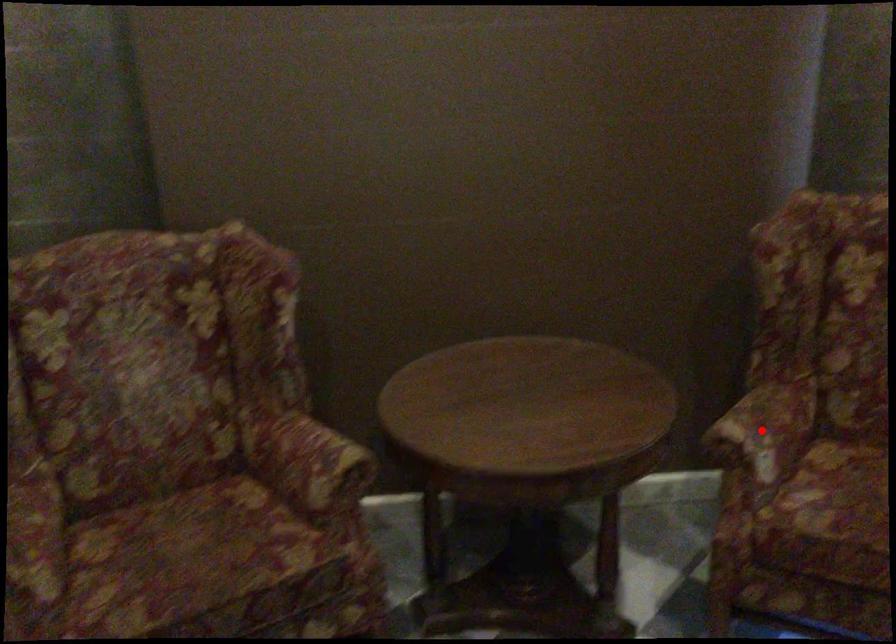
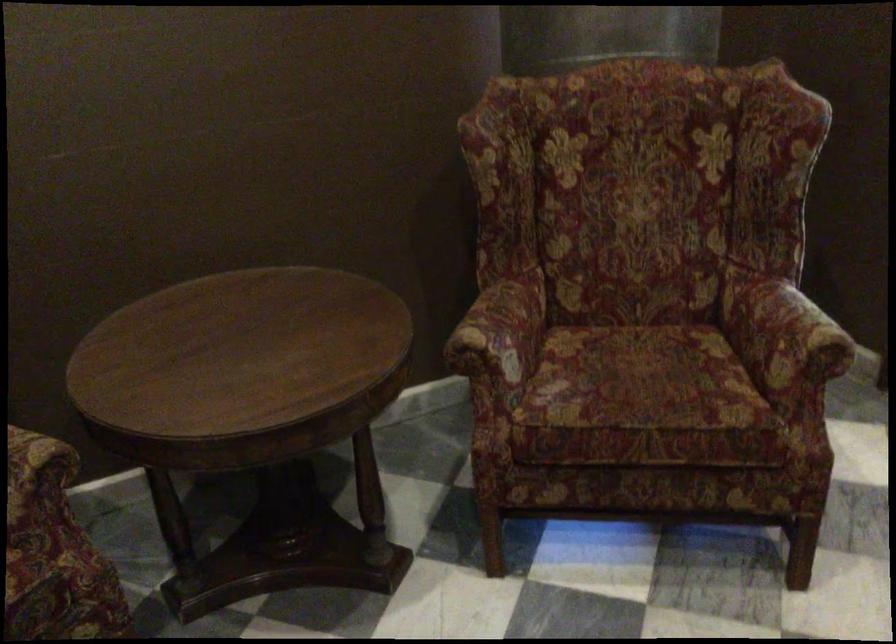
Locate, in the second image, the point that corresponds to the highlighted location in the first image.

(501, 330)